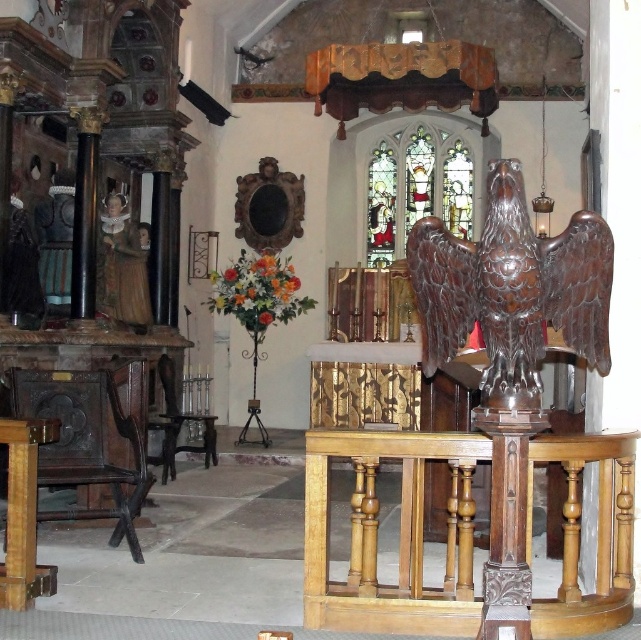
From the picture: You are an interior designer planning to move the shiny brown eagle at center and the wooden table at lower left closer together. Based on their sizes, which object would require more space to accommodate during the rearrangement?

The shiny brown eagle at center is larger in size than the wooden table at lower left, so it would require more space to accommodate during the rearrangement.